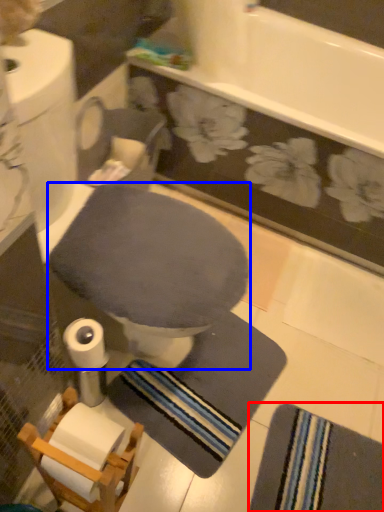
Question: Which object is further to the camera taking this photo, bath towel (highlighted by a red box) or toilet bowl (highlighted by a blue box)?

Choices:
 (A) bath towel
 (B) toilet bowl

Answer: (A)